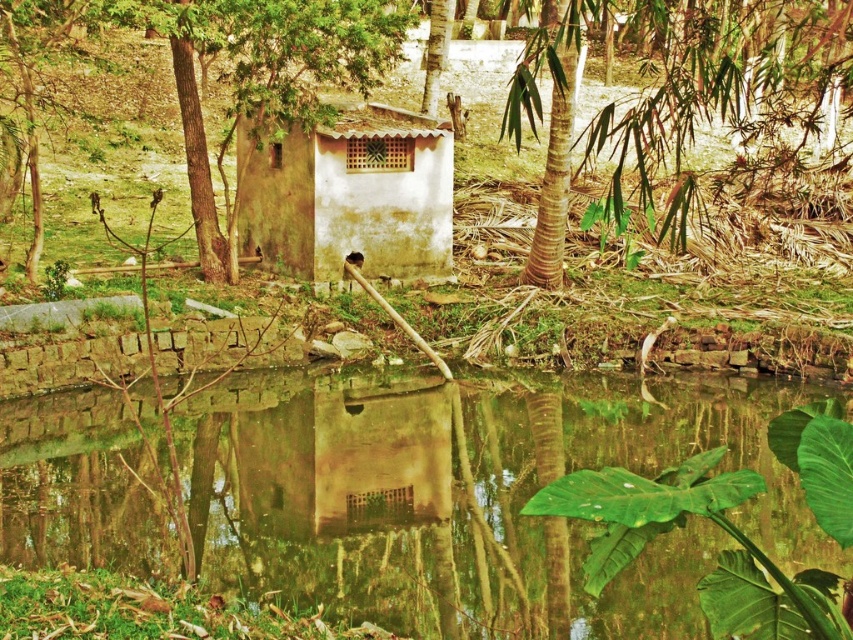
Question: Which object is the closest to the brown rough tree at center?

Choices:
 (A) brown textured bamboo at upper right
 (B) matte white hut at center
 (C) clear water at center
 (D) brown textured tree at center

Answer: (A)

Question: Which point is closer to the camera?

Choices:
 (A) (306, 68)
 (B) (316, 195)

Answer: (A)

Question: Is brown rough tree at center to the left of brown textured bamboo at upper right from the viewer's perspective?

Choices:
 (A) yes
 (B) no

Answer: (A)

Question: Can you confirm if brown rough tree at center is smaller than brown textured bamboo at upper right?

Choices:
 (A) no
 (B) yes

Answer: (A)

Question: Can you confirm if clear water at center is positioned to the left of brown textured tree at center?

Choices:
 (A) no
 (B) yes

Answer: (B)

Question: Estimate the real-world distances between objects in this image. Which object is closer to the matte white hut at center?

Choices:
 (A) clear water at center
 (B) brown textured tree at center
 (C) brown rough tree at center
 (D) brown textured bamboo at upper right

Answer: (C)